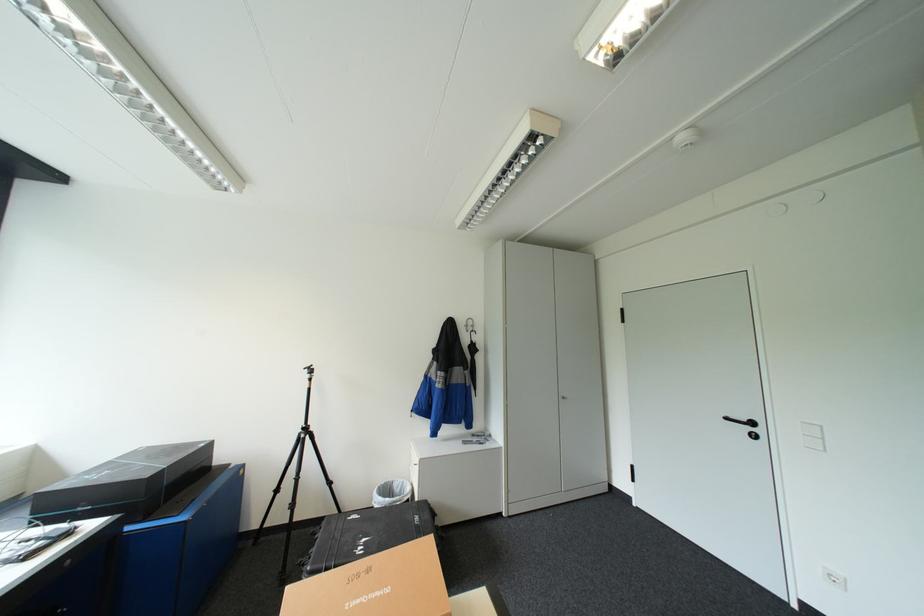
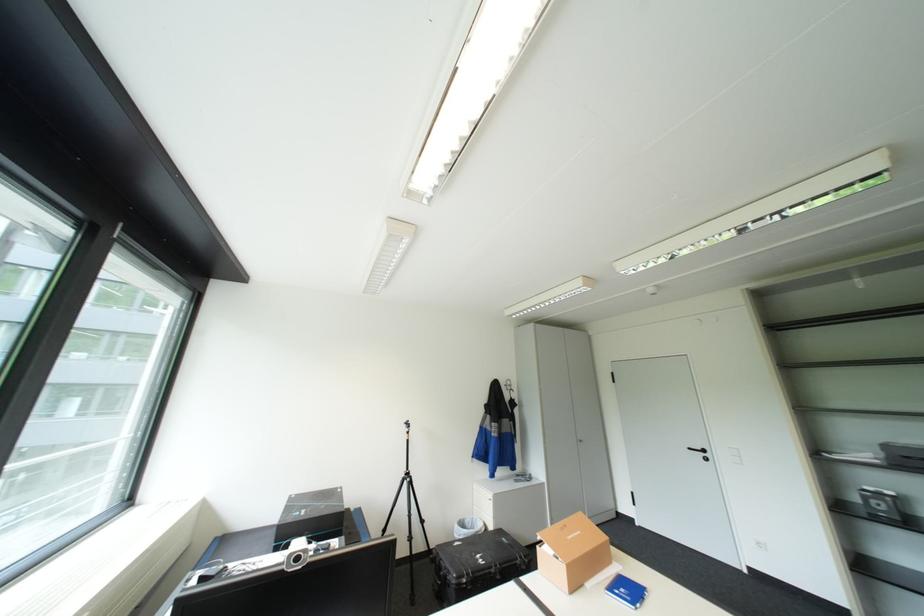
Where in the second image is the point corresponding to pixel 403 484 from the first image?

(475, 521)